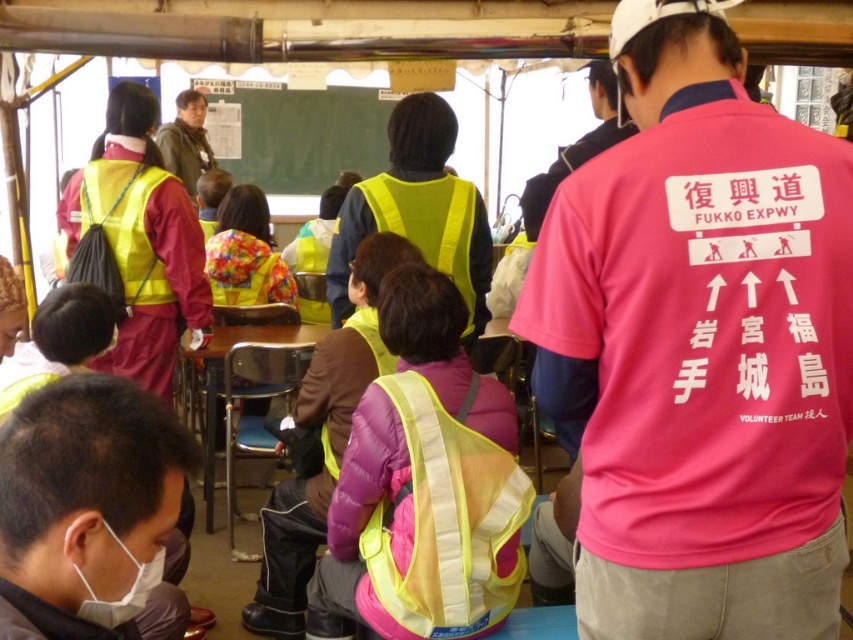
You are organizing a photo shoot and need to ensure that all clothing items in the frame are visible. Given the pink fabric shirt at center and the matte black mask at lower left, which item might be more challenging to capture clearly due to its size?

The matte black mask at lower left might be more challenging to capture clearly due to its smaller size compared to the pink fabric shirt at center.

You are a photographer at the event and need to capture a photo that includes both the pink fabric shirt at center and the matte black mask at lower left. Based on their positions, which one should you focus on first to ensure both are in frame?

The pink fabric shirt at center is above the matte black mask at lower left, so you should focus on the matte black mask at lower left first to ensure both are in frame.